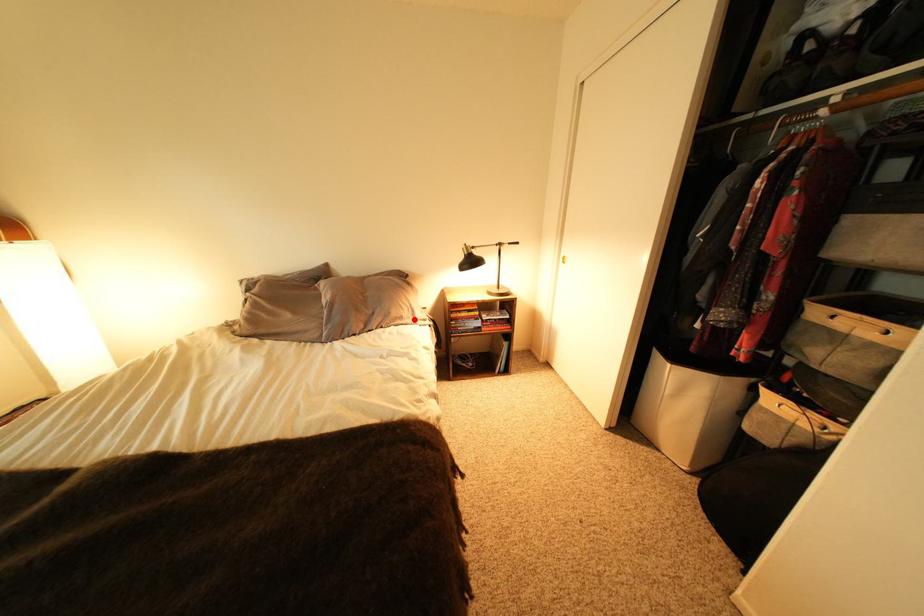
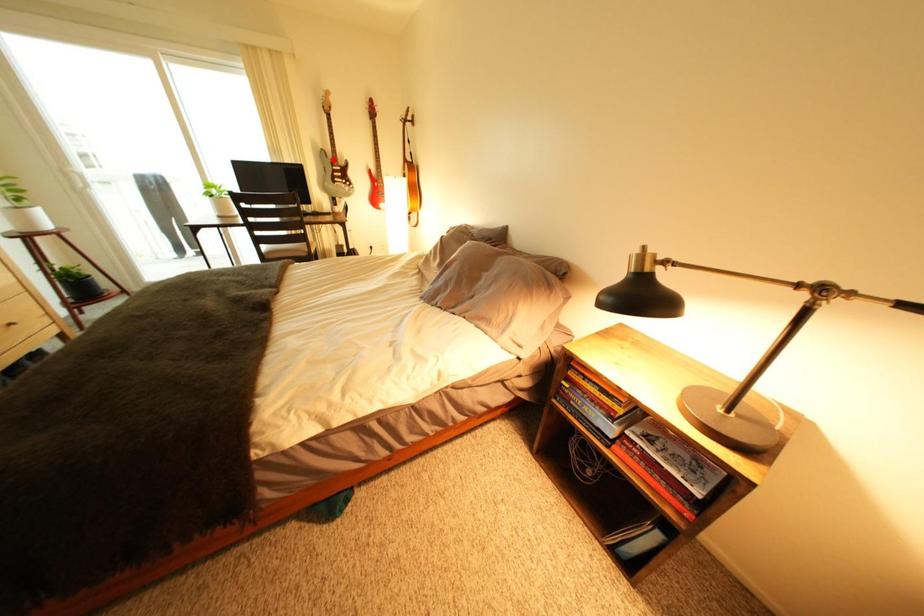
I am providing you with two images of the same scene from different viewpoints. A red point is marked on the first image and another point is marked on the second image. Is the red point in image1 aligned with the point shown in image2?

No